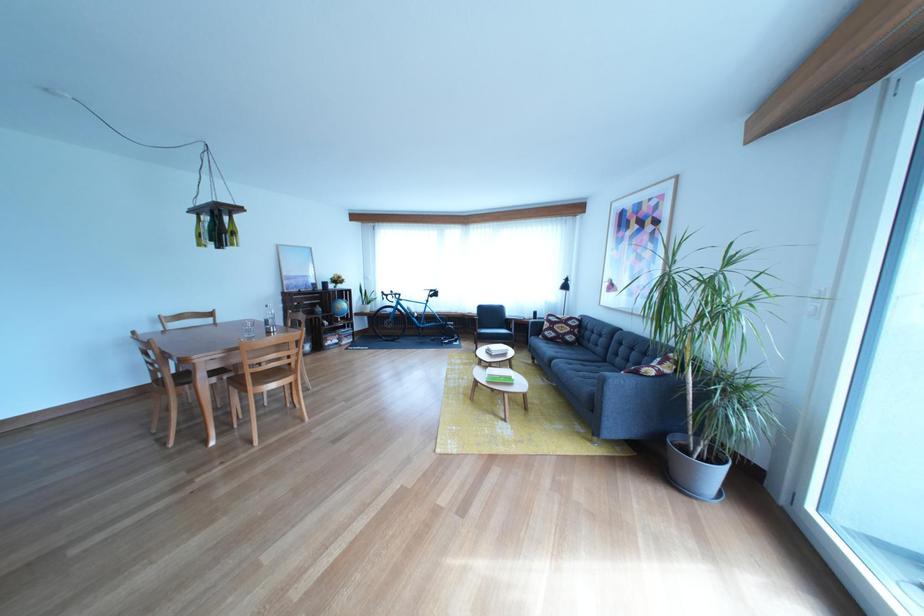
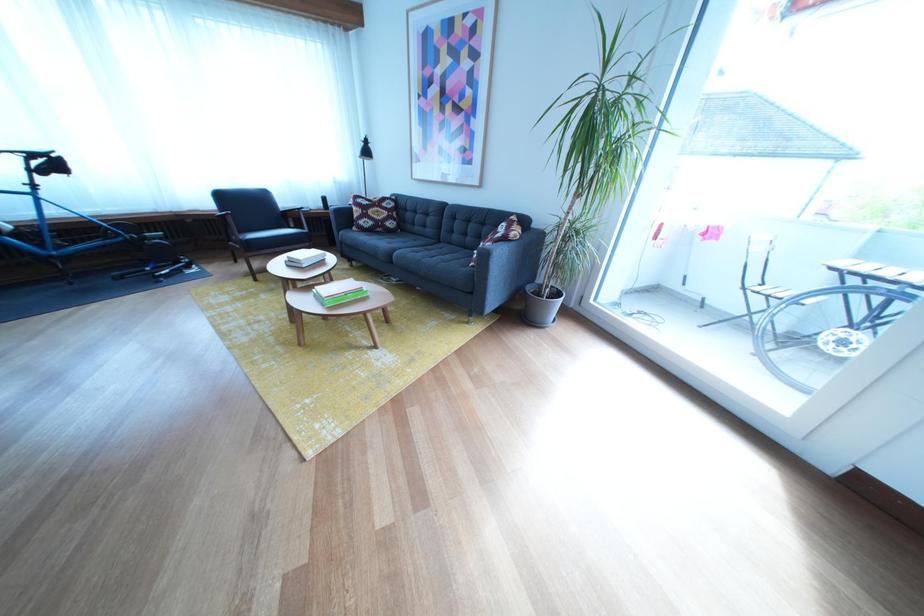
Find the pixel in the second image that matches (618,368) in the first image.

(453, 248)